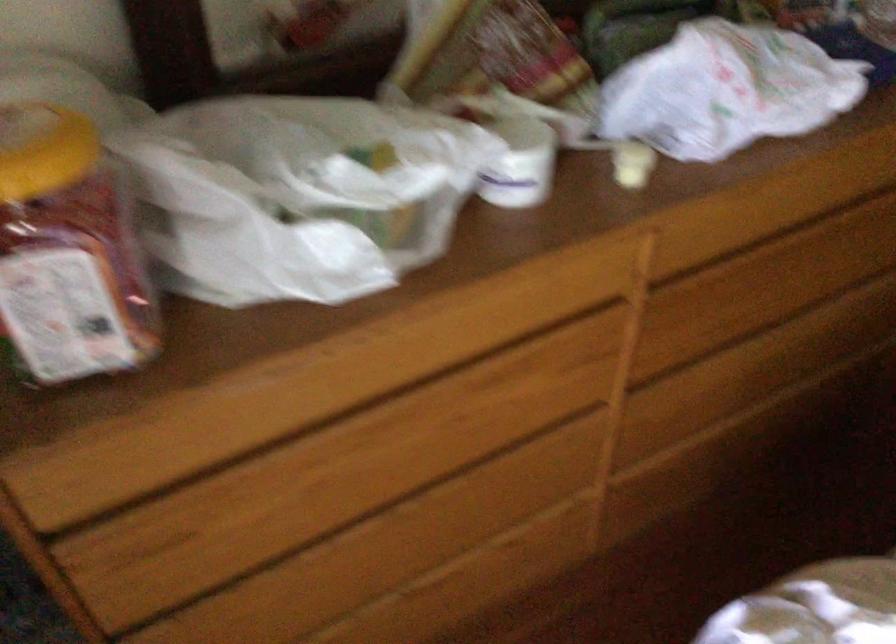
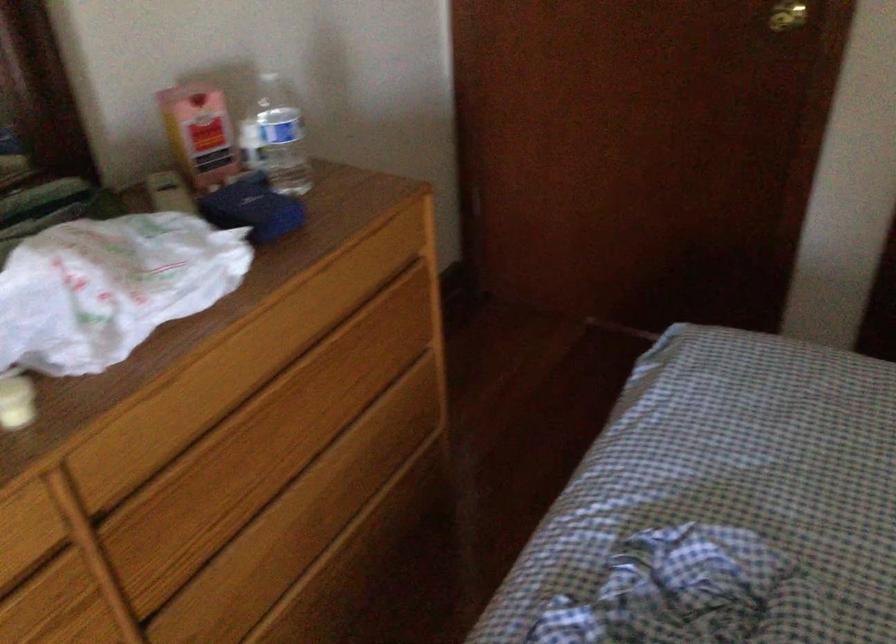
In the second image, find the point that corresponds to (811,263) in the first image.

(291, 413)